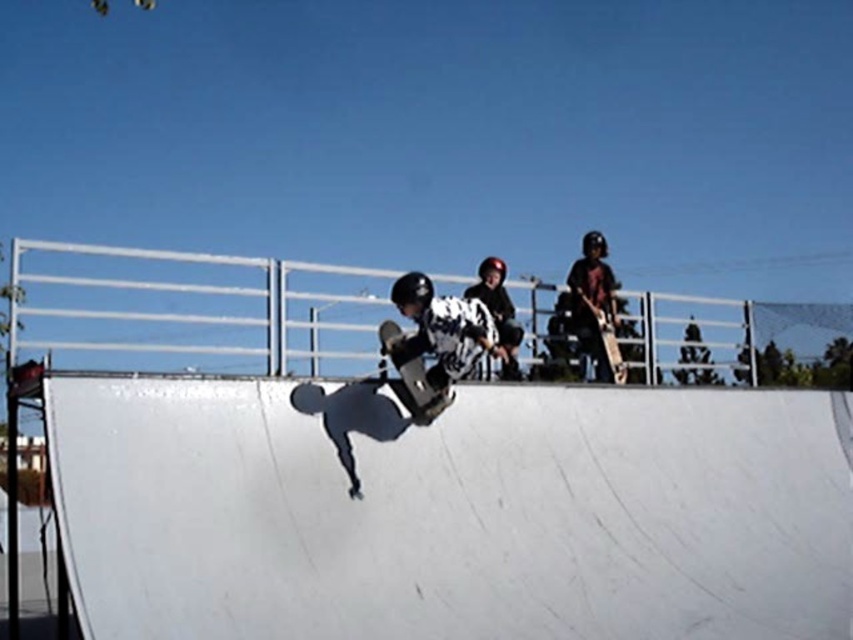
Question: Is white smooth ramp at center positioned in front of wooden skateboard at center?

Choices:
 (A) yes
 (B) no

Answer: (A)

Question: Which of the following is the farthest from the observer?

Choices:
 (A) matte black skateboard at center
 (B) black matte skateboard at center
 (C) dark gray helmet at upper right

Answer: (C)

Question: Which of the following is the closest to the observer?

Choices:
 (A) black matte skateboard at center
 (B) matte black skateboard at center
 (C) dark gray helmet at upper right

Answer: (B)

Question: Is dark gray helmet at upper right closer to camera compared to wooden skateboard at center?

Choices:
 (A) no
 (B) yes

Answer: (A)

Question: Which of the following is the closest to the observer?

Choices:
 (A) (422, 397)
 (B) (433, 321)

Answer: (B)

Question: Can you confirm if matte black skateboard at center is positioned to the left of black matte skateboard at center?

Choices:
 (A) no
 (B) yes

Answer: (A)